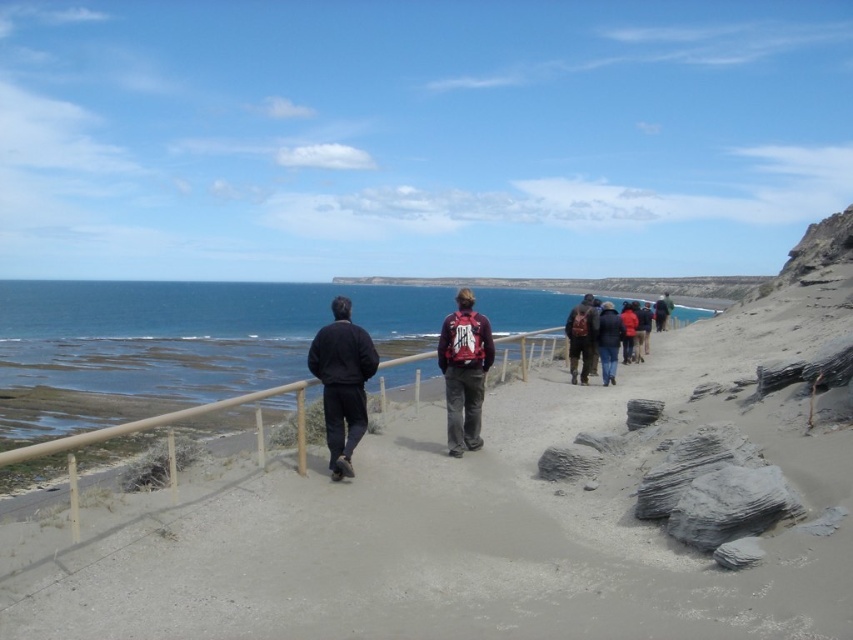
Question: Among these points, which one is farthest from the camera?

Choices:
 (A) (608, 326)
 (B) (570, 342)
 (C) (463, 449)

Answer: (B)

Question: Which point is farther from the camera taking this photo?

Choices:
 (A) (608, 337)
 (B) (605, 321)
 (C) (347, 356)
 (D) (585, 368)

Answer: (D)

Question: From the image, what is the correct spatial relationship of matte red backpack at center in relation to dark blue jeans at center?

Choices:
 (A) below
 (B) above

Answer: (A)

Question: Which of the following is the closest to the observer?

Choices:
 (A) matte brown backpack at center
 (B) dark blue jacket at center

Answer: (B)

Question: Does dark blue jacket at center have a larger size compared to dark brown backpack at center?

Choices:
 (A) no
 (B) yes

Answer: (B)

Question: Is dark brown backpack at center in front of matte brown backpack at center?

Choices:
 (A) yes
 (B) no

Answer: (A)